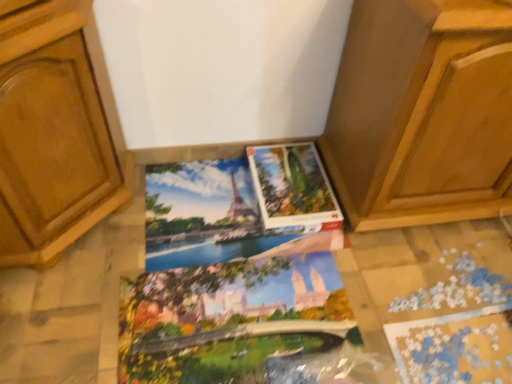
Locate an element on the screen. The width and height of the screenshot is (512, 384). matte paper coloring book at center, marked as the first coloring book in a bottom-to-top arrangement is located at coordinates (229, 319).

Identify the location of wooden cabinet at center. This screenshot has height=384, width=512. (422, 113).

Measure the distance between matte cardboard puzzle at center and camera.

They are 1.45 meters apart.

The width and height of the screenshot is (512, 384). Describe the element at coordinates (293, 187) in the screenshot. I see `matte cardboard puzzle at center` at that location.

The height and width of the screenshot is (384, 512). What are the coordinates of `matte paper coloring book at center, marked as the first coloring book in a bottom-to-top arrangement` in the screenshot? It's located at (229, 319).

Consider the image. Which is less distant, (347, 324) or (463, 127)?

The point (463, 127) is closer.

Can you tell me how much matte paper coloring book at center, marked as the first coloring book in a bottom-to-top arrangement, and wooden cabinet at center differ in facing direction?

The angular difference between matte paper coloring book at center, marked as the first coloring book in a bottom-to-top arrangement, and wooden cabinet at center is 3.19 degrees.

Considering the relative sizes of matte paper coloring book at center, marked as the first coloring book in a bottom-to-top arrangement, and wooden cabinet at center in the image provided, is matte paper coloring book at center, marked as the first coloring book in a bottom-to-top arrangement, thinner than wooden cabinet at center?

No, matte paper coloring book at center, marked as the first coloring book in a bottom-to-top arrangement, is not thinner than wooden cabinet at center.

From a real-world perspective, is matte paper coloring book at center, positioned as the 2th coloring book in top-to-bottom order, on wooden cabinet at center?

Actually, matte paper coloring book at center, positioned as the 2th coloring book in top-to-bottom order, is physically below wooden cabinet at center in the real world.

Is matte paper coloring book at center, positioned as the 2th coloring book in top-to-bottom order, located outside matte cardboard puzzle at center?

Yes.

Is matte paper coloring book at center, marked as the first coloring book in a bottom-to-top arrangement, beside matte cardboard puzzle at center?

matte paper coloring book at center, marked as the first coloring book in a bottom-to-top arrangement, and matte cardboard puzzle at center are not in contact.

Considering the sizes of objects matte paper coloring book at center, positioned as the 2th coloring book in top-to-bottom order, and matte cardboard puzzle at center in the image provided, who is thinner, matte paper coloring book at center, positioned as the 2th coloring book in top-to-bottom order, or matte cardboard puzzle at center?

Thinner between the two is matte cardboard puzzle at center.

The height and width of the screenshot is (384, 512). Identify the location of album above the matte paper coloring book at center, marked as the first coloring book in a bottom-to-top arrangement (from a real-world perspective). (293, 187).

Are wooden cabinet at center and matte cardboard puzzle at center located far from each other?

No, wooden cabinet at center is in close proximity to matte cardboard puzzle at center.

From the image's perspective, is wooden cabinet at center located above or below matte cardboard puzzle at center?

wooden cabinet at center is situated higher than matte cardboard puzzle at center in the image.

Is wooden cabinet at center facing towards matte cardboard puzzle at center?

No.

In the scene shown: Who is bigger, matte cardboard puzzle at center or matte paper coloring book at center, positioned as the 2th coloring book in top-to-bottom order?

Bigger between the two is matte paper coloring book at center, positioned as the 2th coloring book in top-to-bottom order.

From the image's perspective, is matte cardboard puzzle at center positioned above or below matte paper coloring book at center, marked as the first coloring book in a bottom-to-top arrangement?

From the image's perspective, matte cardboard puzzle at center appears above matte paper coloring book at center, marked as the first coloring book in a bottom-to-top arrangement.

Between matte cardboard puzzle at center and matte paper coloring book at center, marked as the first coloring book in a bottom-to-top arrangement, which one has less height?

Standing shorter between the two is matte paper coloring book at center, marked as the first coloring book in a bottom-to-top arrangement.

Would you say matte cardboard puzzle at center is a long distance from matte paper coloring book at center, positioned as the 2th coloring book in top-to-bottom order?

They are positioned close to each other.

Considering the relative sizes of matte paper coloring book at center, positioned as the 2th coloring book in top-to-bottom order, and matte paper coloring book at center, placed as the 2th coloring book when sorted from bottom to top, in the image provided, is matte paper coloring book at center, positioned as the 2th coloring book in top-to-bottom order, wider than matte paper coloring book at center, placed as the 2th coloring book when sorted from bottom to top,?

Yes.

Between matte paper coloring book at center, positioned as the 2th coloring book in top-to-bottom order, and matte paper coloring book at center, placed as the first coloring book when sorted from top to bottom, which one has more height?

matte paper coloring book at center, placed as the first coloring book when sorted from top to bottom.

Consider the image. From a real-world perspective, is matte paper coloring book at center, marked as the first coloring book in a bottom-to-top arrangement, above or below matte paper coloring book at center, placed as the 2th coloring book when sorted from bottom to top?

Clearly, from a real-world perspective, matte paper coloring book at center, marked as the first coloring book in a bottom-to-top arrangement, is above matte paper coloring book at center, placed as the 2th coloring book when sorted from bottom to top.

Find the location of `coloring book above the matte paper coloring book at center, marked as the first coloring book in a bottom-to-top arrangement (from the image's perspective)`. coloring book above the matte paper coloring book at center, marked as the first coloring book in a bottom-to-top arrangement (from the image's perspective) is located at coordinates (203, 214).

In order to click on album lying on the left of wooden cabinet at center in this screenshot , I will do `click(293, 187)`.

Considering the points (279, 154) and (495, 77), which point is in front, point (279, 154) or point (495, 77)?

The point (495, 77) is in front.

Considering the relative sizes of matte cardboard puzzle at center and wooden cabinet at center in the image provided, is matte cardboard puzzle at center smaller than wooden cabinet at center?

Yes.

From a real-world perspective, is matte paper coloring book at center, placed as the first coloring book when sorted from top to bottom, positioned over matte paper coloring book at center, positioned as the 2th coloring book in top-to-bottom order, based on gravity?

No, from a real-world perspective, matte paper coloring book at center, placed as the first coloring book when sorted from top to bottom, is not on top of matte paper coloring book at center, positioned as the 2th coloring book in top-to-bottom order.

Does point (269, 247) come closer to viewer compared to point (216, 317)?

That is False.

How far apart are matte paper coloring book at center, placed as the first coloring book when sorted from top to bottom, and matte paper coloring book at center, marked as the first coloring book in a bottom-to-top arrangement?

The distance of matte paper coloring book at center, placed as the first coloring book when sorted from top to bottom, from matte paper coloring book at center, marked as the first coloring book in a bottom-to-top arrangement, is 23.12 centimeters.

Does matte paper coloring book at center, placed as the 2th coloring book when sorted from bottom to top, come behind matte paper coloring book at center, positioned as the 2th coloring book in top-to-bottom order?

Yes, it is behind matte paper coloring book at center, positioned as the 2th coloring book in top-to-bottom order.

Image resolution: width=512 pixels, height=384 pixels. Identify the location of cabinetry that is on the right side of matte paper coloring book at center, marked as the first coloring book in a bottom-to-top arrangement. (422, 113).

From a real-world perspective, starting from the matte cardboard puzzle at center, which coloring book is the 1st one below it? Please provide its 2D coordinates.

[(229, 319)]

Considering their positions, is matte paper coloring book at center, positioned as the 2th coloring book in top-to-bottom order, positioned closer to wooden cabinet at center than matte paper coloring book at center, placed as the first coloring book when sorted from top to bottom?

Among the two, matte paper coloring book at center, placed as the first coloring book when sorted from top to bottom, is located nearer to wooden cabinet at center.

When comparing their distances from wooden cabinet at center, does matte paper coloring book at center, placed as the first coloring book when sorted from top to bottom, or matte paper coloring book at center, positioned as the 2th coloring book in top-to-bottom order, seem further?

The object further to wooden cabinet at center is matte paper coloring book at center, positioned as the 2th coloring book in top-to-bottom order.

Considering their positions, is matte paper coloring book at center, placed as the first coloring book when sorted from top to bottom, positioned closer to matte paper coloring book at center, marked as the first coloring book in a bottom-to-top arrangement, than matte cardboard puzzle at center?

matte paper coloring book at center, placed as the first coloring book when sorted from top to bottom, is closer to matte paper coloring book at center, marked as the first coloring book in a bottom-to-top arrangement.

Based on their spatial positions, is matte cardboard puzzle at center or matte paper coloring book at center, positioned as the 2th coloring book in top-to-bottom order, closer to matte paper coloring book at center, placed as the 2th coloring book when sorted from bottom to top?

The object closer to matte paper coloring book at center, placed as the 2th coloring book when sorted from bottom to top, is matte cardboard puzzle at center.

Considering their positions, is wooden cabinet at center positioned closer to matte paper coloring book at center, positioned as the 2th coloring book in top-to-bottom order, than matte cardboard puzzle at center?

matte cardboard puzzle at center is positioned closer to the anchor matte paper coloring book at center, positioned as the 2th coloring book in top-to-bottom order.

From the image, which object appears to be nearer to matte cardboard puzzle at center, wooden cabinet at center or matte paper coloring book at center, placed as the 2th coloring book when sorted from bottom to top?

The object closer to matte cardboard puzzle at center is matte paper coloring book at center, placed as the 2th coloring book when sorted from bottom to top.

Looking at the image, which one is located further to matte paper coloring book at center, placed as the 2th coloring book when sorted from bottom to top, wooden cabinet at center or matte paper coloring book at center, positioned as the 2th coloring book in top-to-bottom order?

wooden cabinet at center is further to matte paper coloring book at center, placed as the 2th coloring book when sorted from bottom to top.

Which object lies nearer to the anchor point matte paper coloring book at center, marked as the first coloring book in a bottom-to-top arrangement, wooden cabinet at center or matte paper coloring book at center, placed as the first coloring book when sorted from top to bottom?

Among the two, matte paper coloring book at center, placed as the first coloring book when sorted from top to bottom, is located nearer to matte paper coloring book at center, marked as the first coloring book in a bottom-to-top arrangement.

You are a GUI agent. You are given a task and a screenshot of the screen. Output one action in this format:
    pyautogui.click(x=<x>, y=<y>)
    Task: Click on the coloring book between matte cardboard puzzle at center and matte paper coloring book at center, marked as the first coloring book in a bottom-to-top arrangement, from top to bottom
    Image resolution: width=512 pixels, height=384 pixels.
    Given the screenshot: What is the action you would take?
    pyautogui.click(x=203, y=214)

Find the location of a particular element. This screenshot has height=384, width=512. album between matte paper coloring book at center, placed as the first coloring book when sorted from top to bottom, and wooden cabinet at center, in the horizontal direction is located at coordinates [293, 187].

You are a GUI agent. You are given a task and a screenshot of the screen. Output one action in this format:
    pyautogui.click(x=<x>, y=<y>)
    Task: Click on the coloring book between matte paper coloring book at center, placed as the first coloring book when sorted from top to bottom, and wooden cabinet at center from left to right
    This screenshot has width=512, height=384.
    Given the screenshot: What is the action you would take?
    pyautogui.click(x=229, y=319)

Identify the location of album situated between matte paper coloring book at center, positioned as the 2th coloring book in top-to-bottom order, and wooden cabinet at center from left to right. The width and height of the screenshot is (512, 384). (293, 187).